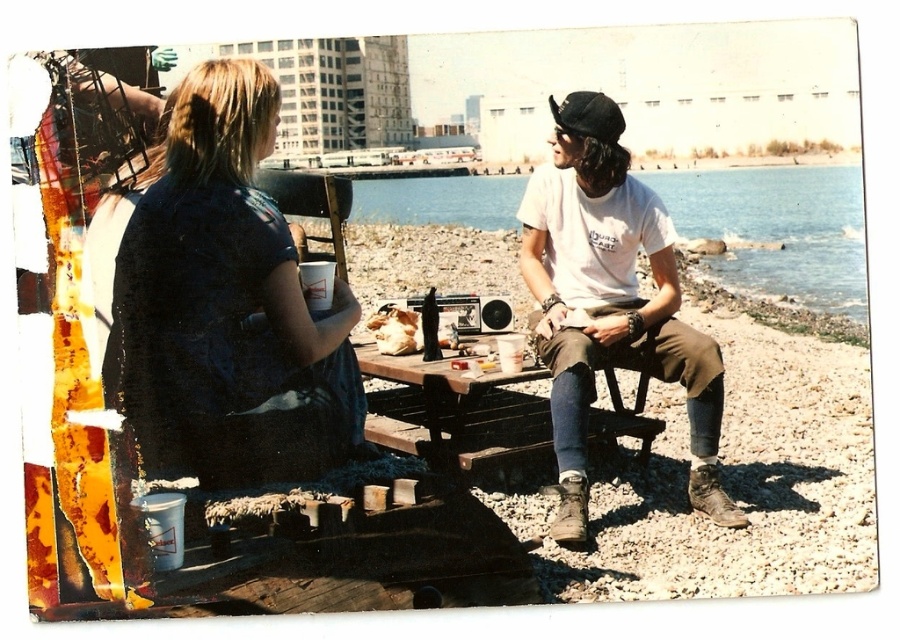
Based on the photo, you are a photographer standing at the edge of the waterfront. You notice the matte blue shirt at center and the blue water at center. Which object is closer to the ground?

The matte blue shirt at center is positioned under blue water at center, so the matte blue shirt at center is closer to the ground.

From the picture: You are planning to set up a temporary tent between the blue water at center and the wooden picnic table at center. Given that the tent requires a space wider than the picnic table, can you determine if there is enough space between them based on their widths?

The blue water at center is wider than the wooden picnic table at center, so yes, there is enough space between them to set up the tent as the required width is met.